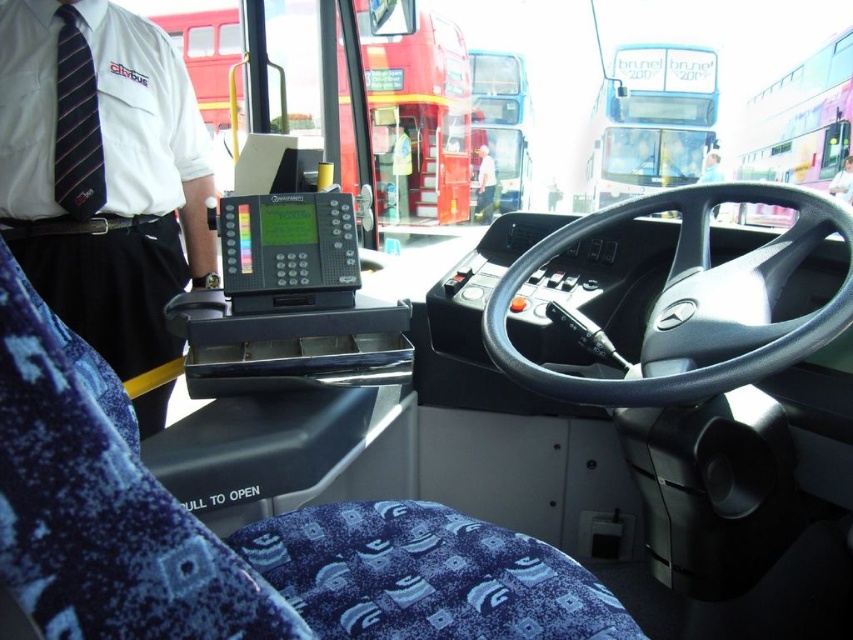
Question: From the image, what is the correct spatial relationship of white shirt with tie at upper left in relation to metallic silver bus at center?

Choices:
 (A) above
 (B) below

Answer: (B)

Question: Which object is closer to the camera taking this photo?

Choices:
 (A) white glossy bus at upper right
 (B) black plastic electronic device at center

Answer: (B)

Question: Which point is closer to the camera taking this photo?

Choices:
 (A) (769, 243)
 (B) (682, 99)

Answer: (A)

Question: Can you confirm if white shirt with tie at upper left is positioned above white glossy bus at upper right?

Choices:
 (A) yes
 (B) no

Answer: (B)

Question: Is black plastic electronic device at center below metallic silver bus at center?

Choices:
 (A) no
 (B) yes

Answer: (A)

Question: Considering the real-world distances, which object is closest to the metallic silver bus at center?

Choices:
 (A) white fabric shirt at center
 (B) white shirt with tie at upper left
 (C) white glossy bus at upper right
 (D) black leather steering wheel at center

Answer: (A)